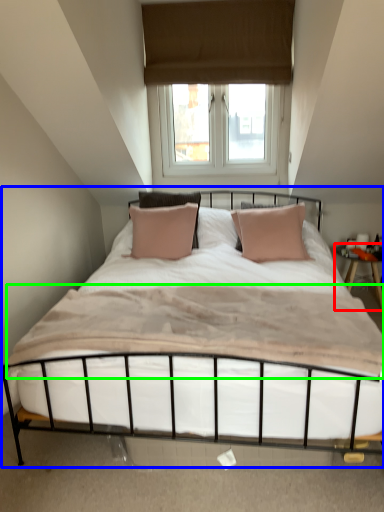
Question: Based on their relative distances, which object is farther from nightstand (highlighted by a red box)? Choose from bed (highlighted by a blue box) and mattress (highlighted by a green box).

Choices:
 (A) bed
 (B) mattress

Answer: (B)